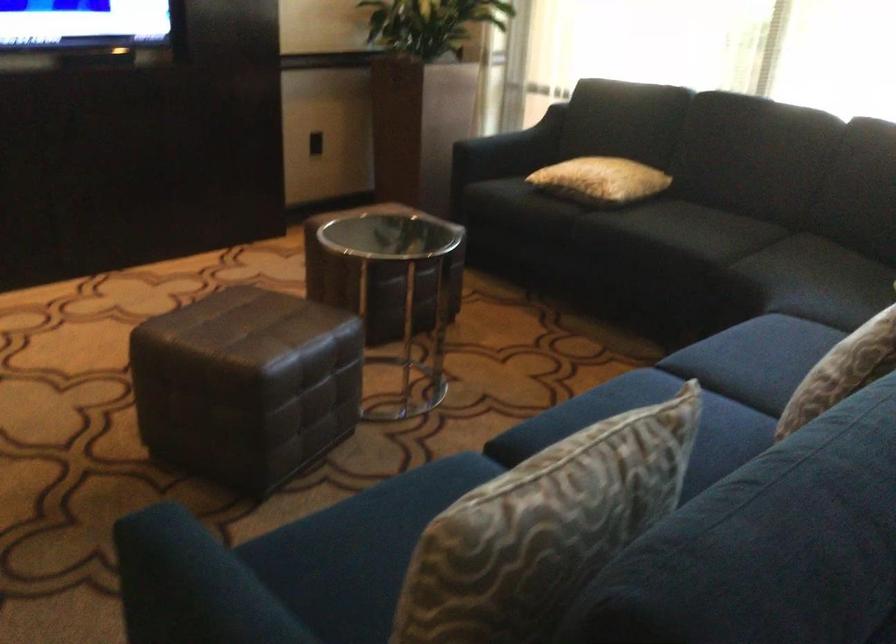
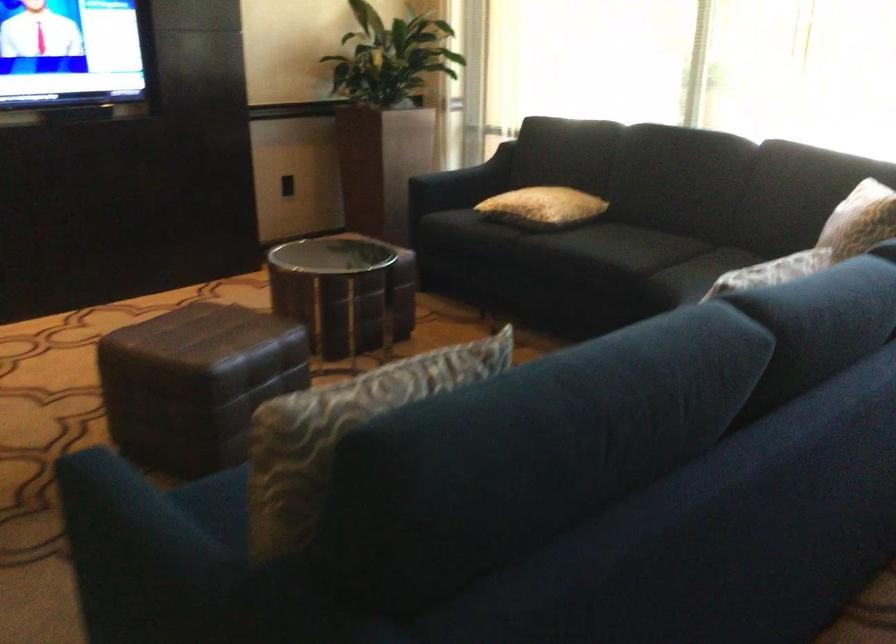
Find the pixel in the second image that matches point 602,180 in the first image.

(543, 207)